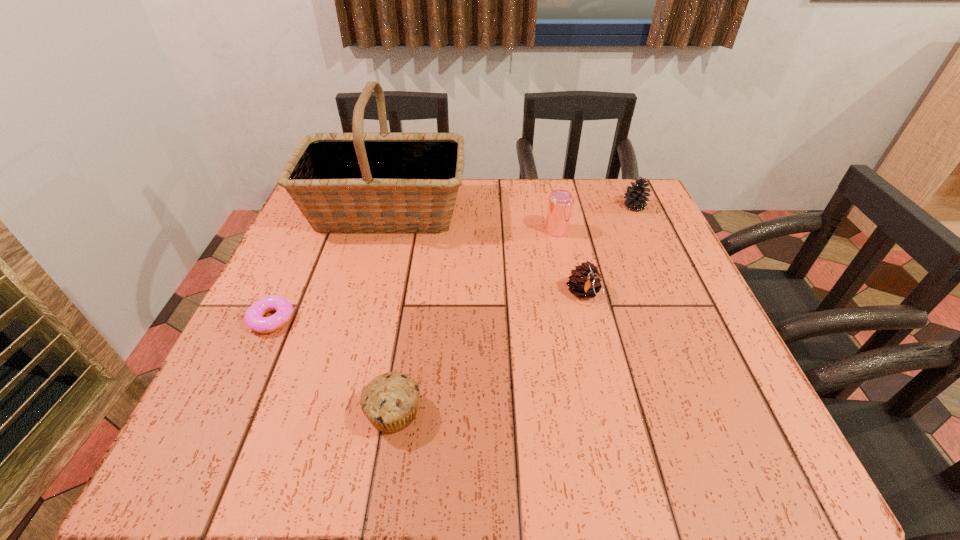
You are a GUI agent. You are given a task and a screenshot of the screen. Output one action in this format:
    pyautogui.click(x=<x>, y=<y>)
    Task: Click on the vacant region that satisfies the following two spatial constraints: 1. by the handle of the muffin; 2. on the left side of the basket
    
    Given the screenshot: What is the action you would take?
    pyautogui.click(x=332, y=413)

I want to click on vacant space that satisfies the following two spatial constraints: 1. on the front side of the farther pinecone; 2. by the handle of the basket, so click(636, 212).

Where is `free space in the image that satisfies the following two spatial constraints: 1. by the handle of the basket; 2. on the left side of the second tallest object`? This screenshot has height=540, width=960. free space in the image that satisfies the following two spatial constraints: 1. by the handle of the basket; 2. on the left side of the second tallest object is located at coordinates (381, 231).

You are a GUI agent. You are given a task and a screenshot of the screen. Output one action in this format:
    pyautogui.click(x=<x>, y=<y>)
    Task: Click on the vacant region that satisfies the following two spatial constraints: 1. on the back side of the right pinecone; 2. on the left side of the muffin
    Image resolution: width=960 pixels, height=540 pixels.
    Given the screenshot: What is the action you would take?
    pyautogui.click(x=426, y=206)

The width and height of the screenshot is (960, 540). In order to click on free location that satisfies the following two spatial constraints: 1. on the back side of the shortest object; 2. on the left side of the second tallest object in this screenshot , I will do `click(313, 231)`.

You are a GUI agent. You are given a task and a screenshot of the screen. Output one action in this format:
    pyautogui.click(x=<x>, y=<y>)
    Task: Click on the vacant space that satisfies the following two spatial constraints: 1. on the back side of the fifth shortest object; 2. on the right side of the rightmost object
    The width and height of the screenshot is (960, 540).
    Given the screenshot: What is the action you would take?
    pyautogui.click(x=551, y=206)